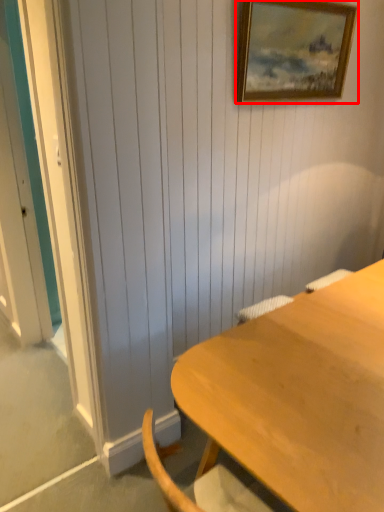
Question: In this image, where is picture frame (annotated by the red box) located relative to desk?

Choices:
 (A) right
 (B) left

Answer: (A)